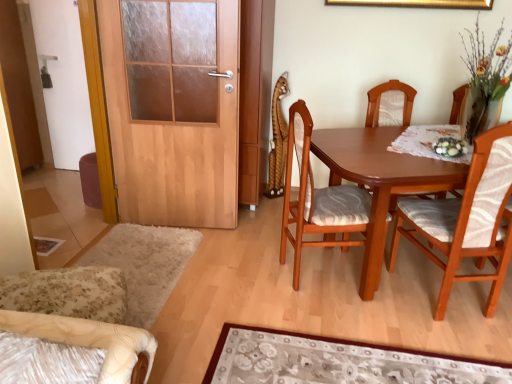
Where is `free space below wooden door at left (from a real-world perspective)`? The width and height of the screenshot is (512, 384). free space below wooden door at left (from a real-world perspective) is located at coordinates (183, 222).